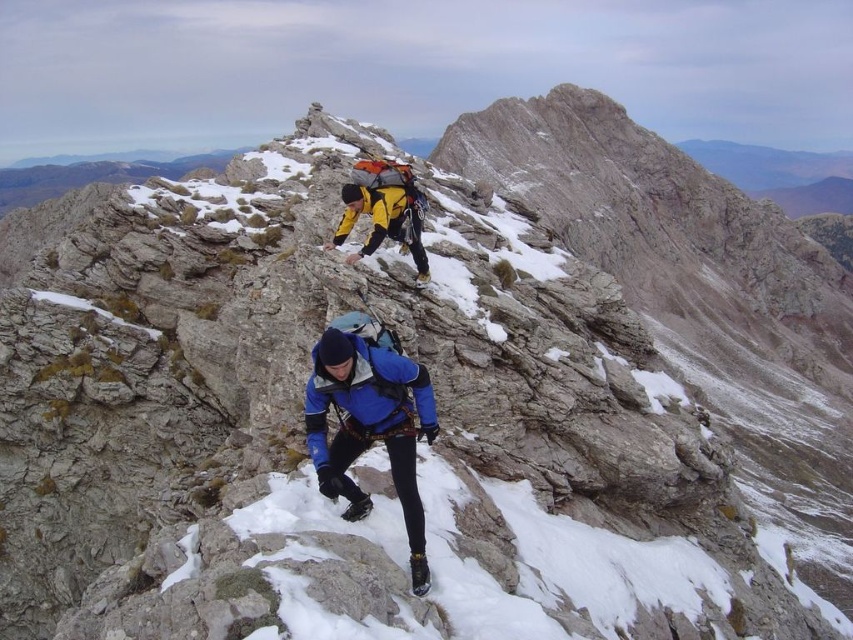
This screenshot has height=640, width=853. What do you see at coordinates (370, 426) in the screenshot?
I see `blue fabric jacket at lower center` at bounding box center [370, 426].

At what (x,y) coordinates should I click in order to perform the action: click on blue fabric jacket at lower center. Please return your answer as a coordinate pair (x, y). This screenshot has height=640, width=853. Looking at the image, I should click on (370, 426).

Does point (349, 372) come closer to viewer compared to point (352, 218)?

Yes, it is.

Locate an element on the screen. This screenshot has width=853, height=640. blue fabric jacket at lower center is located at coordinates (370, 426).